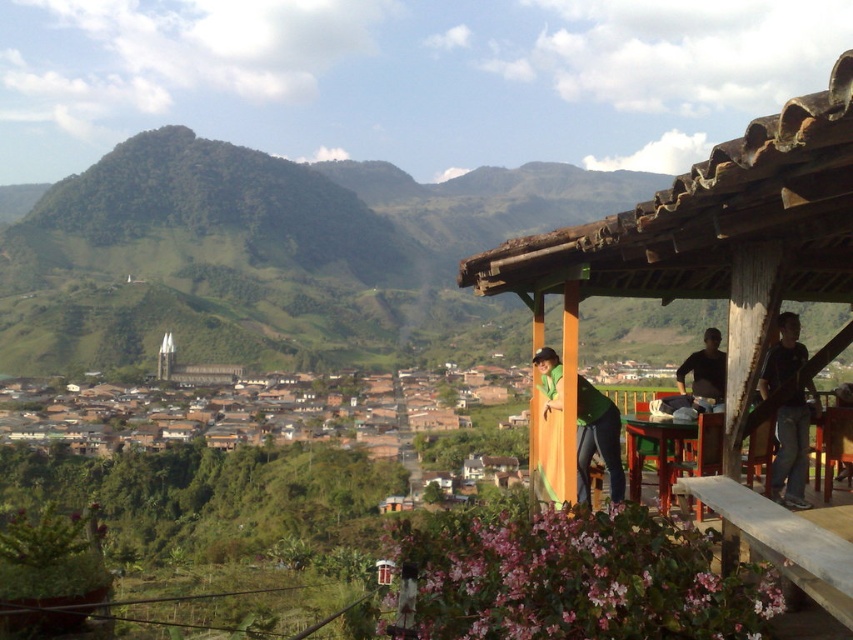
Which is more to the right, green matte shirt at center or black matte shirt at upper right?

black matte shirt at upper right

Can you confirm if green matte shirt at center is thinner than black matte shirt at upper right?

Yes.

Between point (610, 432) and point (664, 410), which one is positioned behind?

The point (664, 410) is more distant.

This screenshot has height=640, width=853. I want to click on green matte shirt at center, so click(x=596, y=440).

Does dark blue jeans at right appear on the left side of green matte shirt at center?

No, dark blue jeans at right is not to the left of green matte shirt at center.

Between dark blue jeans at right and green matte shirt at center, which one is positioned higher?

dark blue jeans at right is higher up.

Where is `dark blue jeans at right`? This screenshot has height=640, width=853. dark blue jeans at right is located at coordinates (792, 448).

You are a GUI agent. You are given a task and a screenshot of the screen. Output one action in this format:
    pyautogui.click(x=<x>, y=<y>)
    Task: Click on the dark blue jeans at right
    The image size is (853, 640).
    Given the screenshot: What is the action you would take?
    pyautogui.click(x=792, y=448)

Between wooden gazebo at upper right and green matte shirt at center, which one has more height?

Standing taller between the two is wooden gazebo at upper right.

Between point (712, 492) and point (584, 484), which one is positioned behind?

The point (584, 484) is more distant.

What are the coordinates of `wooden gazebo at upper right` in the screenshot? It's located at [708, 243].